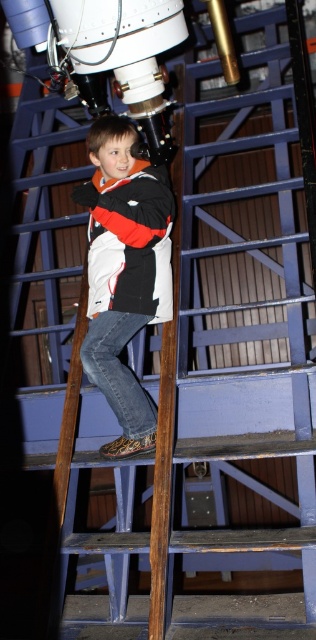
Question: Among these objects, which one is nearest to the camera?

Choices:
 (A) denim jacket at center
 (B) white matte jacket at center

Answer: (A)

Question: Which point is farther from the camera taking this photo?

Choices:
 (A) (144, 180)
 (B) (93, 182)

Answer: (B)

Question: In this image, where is denim jacket at center located relative to white matte jacket at center?

Choices:
 (A) below
 (B) above

Answer: (A)

Question: Is denim jacket at center to the right of white matte jacket at center from the viewer's perspective?

Choices:
 (A) yes
 (B) no

Answer: (A)

Question: Which of the following is the closest to the observer?

Choices:
 (A) (98, 173)
 (B) (108, 305)

Answer: (B)

Question: Is denim jacket at center below white matte jacket at center?

Choices:
 (A) no
 (B) yes

Answer: (B)